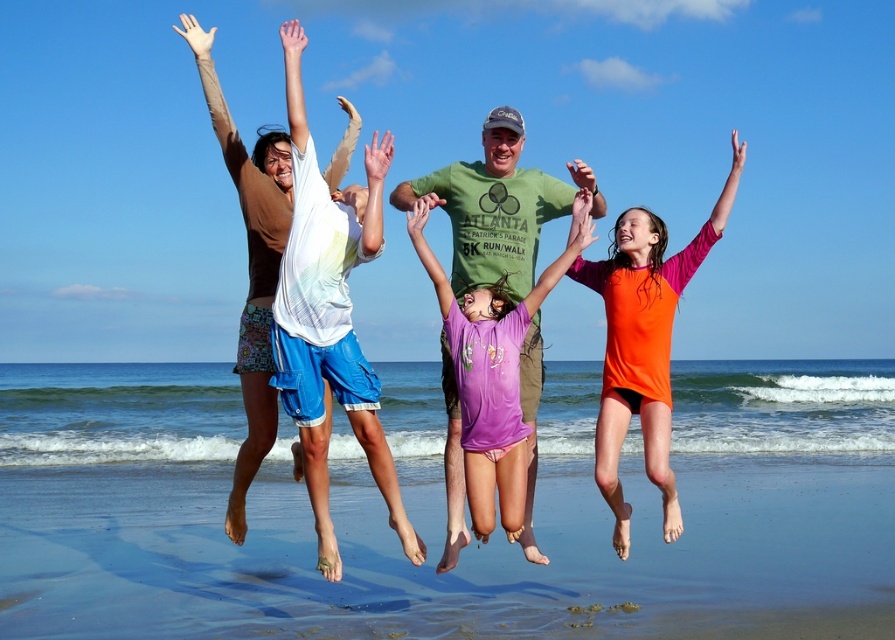
You are a photographer at the beach and want to ensure both the matte white shirt at center and the purple cotton shirt at center are visible in your photo. Given their sizes, which one might you need to adjust your focus on to capture clearly?

The matte white shirt at center is larger than the purple cotton shirt at center, so you should focus on the matte white shirt at center to ensure it is clearly visible in the photo.

From the picture: You are a photographer capturing the beach scene. You notice two individuals at the center of the image wearing the matte white shirt at center and the orange rash guard at center. Which one is higher in the air during their jump?

The matte white shirt at center is located above the orange rash guard at center, so the person wearing the matte white shirt at center is higher in the air during their jump.